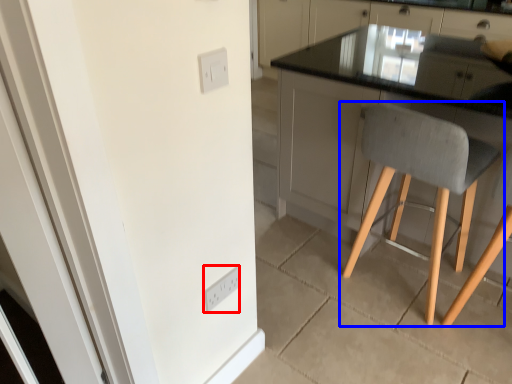
Question: Which object is closer to the camera taking this photo, light switch (highlighted by a red box) or chair (highlighted by a blue box)?

Choices:
 (A) light switch
 (B) chair

Answer: (B)